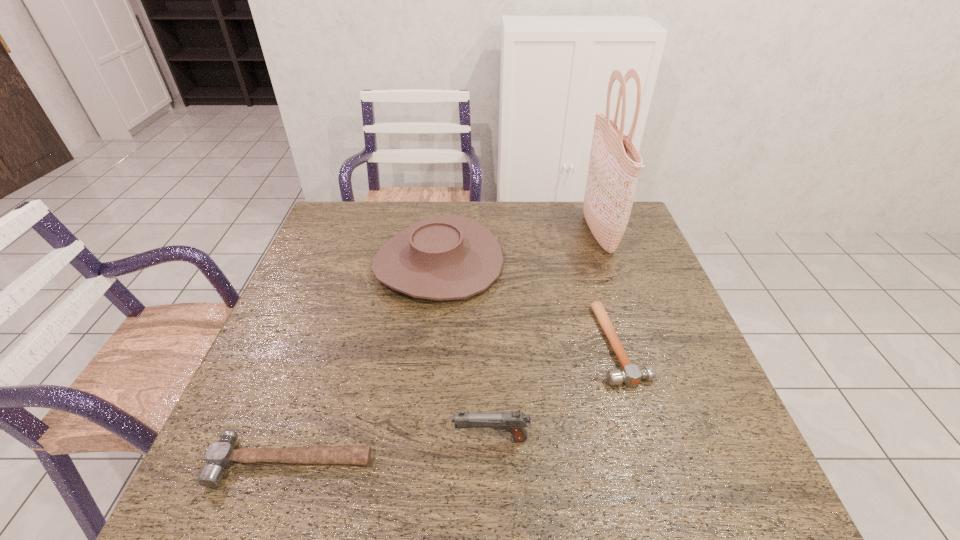
The height and width of the screenshot is (540, 960). What are the coordinates of `blank area at the near edge` in the screenshot? It's located at (536, 472).

At what (x,y) coordinates should I click in order to perform the action: click on free space at the left edge. Please return your answer as a coordinate pair (x, y). This screenshot has height=540, width=960. Looking at the image, I should click on (345, 301).

At what (x,y) coordinates should I click in order to perform the action: click on free region at the right edge. Please return your answer as a coordinate pair (x, y). Looking at the image, I should click on (655, 413).

In the image, there is a desktop. At what (x,y) coordinates should I click in order to perform the action: click on vacant space at the near left corner. Please return your answer as a coordinate pair (x, y). The height and width of the screenshot is (540, 960). Looking at the image, I should click on (208, 491).

This screenshot has width=960, height=540. What are the coordinates of `free space between the gun and the tallest object` in the screenshot? It's located at (544, 335).

The width and height of the screenshot is (960, 540). Identify the location of free space between the cowboy hat and the nearer hammer. (365, 362).

Find the location of a particular element. The image size is (960, 540). free area in between the cowboy hat and the shopping bag is located at coordinates (518, 247).

Where is `vacant region between the cowboy hat and the gun`? vacant region between the cowboy hat and the gun is located at coordinates (465, 351).

Find the location of a particular element. vacant area between the cowboy hat and the right hammer is located at coordinates (529, 303).

Locate an element on the screen. free spot between the right hammer and the left hammer is located at coordinates (455, 403).